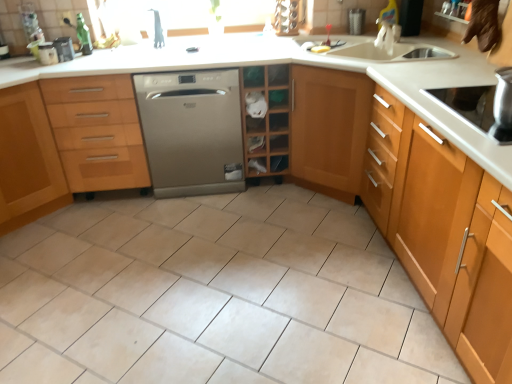
What do you see at coordinates (445, 232) in the screenshot?
I see `light brown wood cabinet at right, marked as the 1th cabinetry in a right-to-left arrangement` at bounding box center [445, 232].

Image resolution: width=512 pixels, height=384 pixels. I want to click on black plastic container at upper left, so click(64, 49).

Describe the element at coordinates (77, 141) in the screenshot. I see `wooden cabinet at left, marked as the second cabinetry in a left-to-right arrangement` at that location.

This screenshot has width=512, height=384. What do you see at coordinates (483, 105) in the screenshot?
I see `stainless steel cooktop at right` at bounding box center [483, 105].

Measure the distance between point [260,162] and camera.

The depth of point [260,162] is 9.10 feet.

Find the location of a particular element. Image resolution: width=512 pixels, height=384 pixels. satin silver dishwasher at center is located at coordinates (192, 131).

Between wooden cabinet at left, marked as the second cabinetry in a left-to-right arrangement, and stainless steel cooktop at right, which one has less height?

Standing shorter between the two is stainless steel cooktop at right.

Could you tell me if wooden cabinet at left, marked as the 2th cabinetry in a right-to-left arrangement, is facing stainless steel cooktop at right?

No.

Is wooden cabinet at left, marked as the 2th cabinetry in a right-to-left arrangement, inside the boundaries of stainless steel cooktop at right, or outside?

wooden cabinet at left, marked as the 2th cabinetry in a right-to-left arrangement, exists outside the volume of stainless steel cooktop at right.

Is wooden cabinet at left, marked as the 2th cabinetry in a right-to-left arrangement, shorter than satin silver dishwasher at center?

Yes, wooden cabinet at left, marked as the 2th cabinetry in a right-to-left arrangement, is shorter than satin silver dishwasher at center.

Considering the relative sizes of wooden cabinet at left, marked as the 2th cabinetry in a right-to-left arrangement, and satin silver dishwasher at center in the image provided, is wooden cabinet at left, marked as the 2th cabinetry in a right-to-left arrangement, wider than satin silver dishwasher at center?

Incorrect, the width of wooden cabinet at left, marked as the 2th cabinetry in a right-to-left arrangement, does not surpass that of satin silver dishwasher at center.

Are wooden cabinet at left, marked as the 2th cabinetry in a right-to-left arrangement, and satin silver dishwasher at center making contact?

No, wooden cabinet at left, marked as the 2th cabinetry in a right-to-left arrangement, is not with satin silver dishwasher at center.

Is light brown wood cabinet at left, marked as the third cabinetry in a right-to-left arrangement, positioned with its back to wooden cabinet at left, marked as the 2th cabinetry in a right-to-left arrangement?

light brown wood cabinet at left, marked as the third cabinetry in a right-to-left arrangement, does not have its back to wooden cabinet at left, marked as the 2th cabinetry in a right-to-left arrangement.

From the picture: Considering the sizes of objects light brown wood cabinet at left, marked as the first cabinetry in a left-to-right arrangement, and wooden cabinet at left, marked as the 2th cabinetry in a right-to-left arrangement, in the image provided, who is bigger, light brown wood cabinet at left, marked as the first cabinetry in a left-to-right arrangement, or wooden cabinet at left, marked as the 2th cabinetry in a right-to-left arrangement,?

light brown wood cabinet at left, marked as the first cabinetry in a left-to-right arrangement.

Is the surface of light brown wood cabinet at left, marked as the first cabinetry in a left-to-right arrangement, in direct contact with wooden cabinet at left, marked as the 2th cabinetry in a right-to-left arrangement?

They are not placed beside each other.

From a real-world perspective, does light brown wood cabinet at left, marked as the first cabinetry in a left-to-right arrangement, stand above wooden cabinet at left, marked as the 2th cabinetry in a right-to-left arrangement?

No, from a real-world perspective, light brown wood cabinet at left, marked as the first cabinetry in a left-to-right arrangement, is not above wooden cabinet at left, marked as the 2th cabinetry in a right-to-left arrangement.

Is satin silver dishwasher at center oriented towards stainless steel cooktop at right?

No, satin silver dishwasher at center does not turn towards stainless steel cooktop at right.

Considering the relative positions of satin silver dishwasher at center and stainless steel cooktop at right in the image provided, is satin silver dishwasher at center in front of stainless steel cooktop at right?

No, satin silver dishwasher at center is further to the viewer.

Looking at this image, what's the angular difference between satin silver dishwasher at center and stainless steel cooktop at right's facing directions?

They differ by 89.1 degrees in their facing directions.

Is wooden shelf at center a part of stainless steel cooktop at right?

No, stainless steel cooktop at right does not contain wooden shelf at center.

Looking at this image, from the image's perspective, which one is positioned higher, stainless steel cooktop at right or wooden shelf at center?

wooden shelf at center, from the image's perspective.

Is stainless steel cooktop at right at the left side of wooden shelf at center?

No, stainless steel cooktop at right is not to the left of wooden shelf at center.

Locate an element on the screen. kitchen appliance in front of the wooden cabinet at left, marked as the second cabinetry in a left-to-right arrangement is located at coordinates (483, 105).

Is wooden cabinet at left, marked as the second cabinetry in a left-to-right arrangement, at the back of stainless steel cooktop at right?

No, wooden cabinet at left, marked as the second cabinetry in a left-to-right arrangement, is not at the back of stainless steel cooktop at right.

Is stainless steel cooktop at right closer to camera compared to wooden cabinet at left, marked as the second cabinetry in a left-to-right arrangement?

Yes, it is.

Between stainless steel cooktop at right and wooden cabinet at left, marked as the second cabinetry in a left-to-right arrangement, which one has less height?

Standing shorter between the two is stainless steel cooktop at right.

How distant is wooden shelf at center from wooden cabinet at left, marked as the second cabinetry in a left-to-right arrangement?

wooden shelf at center is 35.86 inches away from wooden cabinet at left, marked as the second cabinetry in a left-to-right arrangement.

From a real-world perspective, which is physically below, wooden shelf at center or wooden cabinet at left, marked as the 2th cabinetry in a right-to-left arrangement?

wooden shelf at center, from a real-world perspective.

How different are the orientations of wooden shelf at center and wooden cabinet at left, marked as the second cabinetry in a left-to-right arrangement, in degrees?

There is a 0.823-degree angle between the facing directions of wooden shelf at center and wooden cabinet at left, marked as the second cabinetry in a left-to-right arrangement.

Based on their positions, is wooden shelf at center located to the left or right of wooden cabinet at left, marked as the second cabinetry in a left-to-right arrangement?

From the image, it's evident that wooden shelf at center is to the right of wooden cabinet at left, marked as the second cabinetry in a left-to-right arrangement.

From a real-world perspective, which cabinetry is the 1st one underneath the stainless steel cooktop at right? Please provide its 2D coordinates.

[(77, 141)]

Locate an element on the screen. This screenshot has width=512, height=384. home appliance located behind the wooden cabinet at left, marked as the second cabinetry in a left-to-right arrangement is located at coordinates (192, 131).

Estimate the real-world distances between objects in this image. Which object is further from wooden shelf at center, stainless steel cooktop at right or light brown wood cabinet at right, acting as the third cabinetry starting from the left?

light brown wood cabinet at right, acting as the third cabinetry starting from the left, lies further to wooden shelf at center than the other object.

Which object lies further to the anchor point black plastic container at upper left, light brown wood cabinet at right, marked as the 1th cabinetry in a right-to-left arrangement, or wooden shelf at center?

Based on the image, light brown wood cabinet at right, marked as the 1th cabinetry in a right-to-left arrangement, appears to be further to black plastic container at upper left.

From the image, which object appears to be farther from black plastic container at upper left, stainless steel cooktop at right or wooden cabinet at left, marked as the second cabinetry in a left-to-right arrangement?

Among the two, stainless steel cooktop at right is located further to black plastic container at upper left.

Consider the image. Which object lies nearer to the anchor point satin silver dishwasher at center, light brown wood cabinet at left, marked as the first cabinetry in a left-to-right arrangement, or wooden cabinet at left, marked as the second cabinetry in a left-to-right arrangement?

Among the two, wooden cabinet at left, marked as the second cabinetry in a left-to-right arrangement, is located nearer to satin silver dishwasher at center.

From the image, which object appears to be nearer to light brown wood cabinet at right, acting as the third cabinetry starting from the left, wooden shelf at center or light brown wood cabinet at left, marked as the third cabinetry in a right-to-left arrangement?

wooden shelf at center lies closer to light brown wood cabinet at right, acting as the third cabinetry starting from the left, than the other object.

Estimate the real-world distances between objects in this image. Which object is further from stainless steel cooktop at right, light brown wood cabinet at right, marked as the 1th cabinetry in a right-to-left arrangement, or light brown wood cabinet at left, marked as the first cabinetry in a left-to-right arrangement?

The object further to stainless steel cooktop at right is light brown wood cabinet at left, marked as the first cabinetry in a left-to-right arrangement.

Which object lies further to the anchor point wooden cabinet at left, marked as the 2th cabinetry in a right-to-left arrangement, light brown wood cabinet at left, marked as the first cabinetry in a left-to-right arrangement, or black plastic container at upper left?

The object further to wooden cabinet at left, marked as the 2th cabinetry in a right-to-left arrangement, is black plastic container at upper left.

Consider the image. Considering their positions, is satin silver dishwasher at center positioned further to wooden cabinet at left, marked as the 2th cabinetry in a right-to-left arrangement, than light brown wood cabinet at right, acting as the third cabinetry starting from the left?

light brown wood cabinet at right, acting as the third cabinetry starting from the left, is further to wooden cabinet at left, marked as the 2th cabinetry in a right-to-left arrangement.

I want to click on appliance between light brown wood cabinet at left, marked as the third cabinetry in a right-to-left arrangement, and wooden cabinet at left, marked as the second cabinetry in a left-to-right arrangement, in the horizontal direction, so click(x=64, y=49).

Identify the location of shelf located between light brown wood cabinet at left, marked as the first cabinetry in a left-to-right arrangement, and light brown wood cabinet at right, acting as the third cabinetry starting from the left, in the left-right direction. The width and height of the screenshot is (512, 384). (266, 120).

Identify the location of cabinetry between black plastic container at upper left and wooden shelf at center. point(77,141).

This screenshot has width=512, height=384. I want to click on appliance between light brown wood cabinet at left, marked as the third cabinetry in a right-to-left arrangement, and stainless steel cooktop at right from left to right, so click(64, 49).